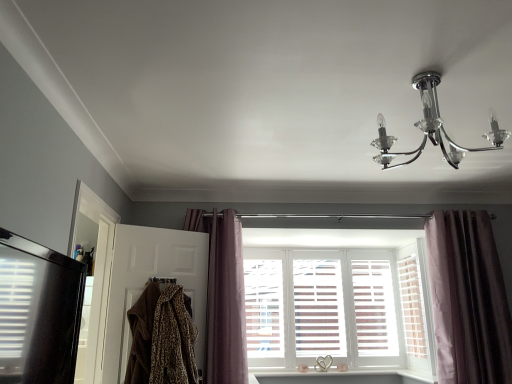
Identify the location of empty space that is ontop of white wood shutter at center (from a real-world perspective). This screenshot has height=384, width=512. (403, 245).